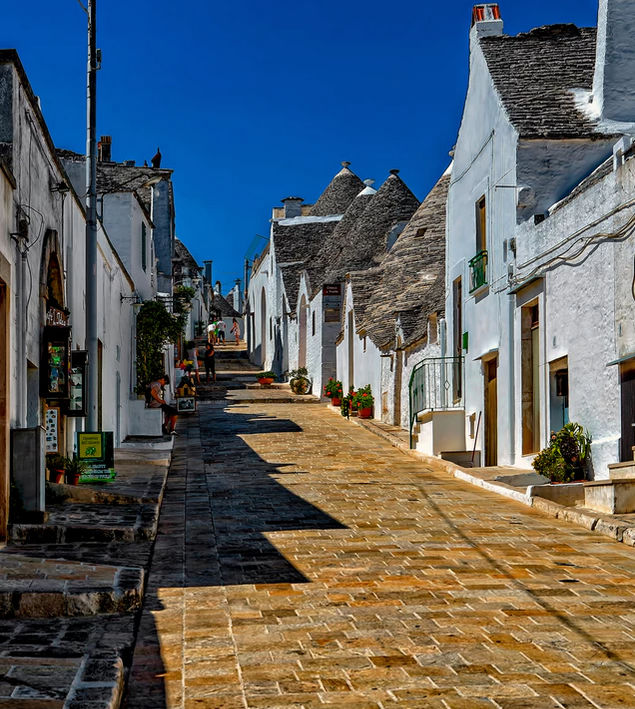
The image size is (635, 709). I want to click on stairs, so click(422, 423).